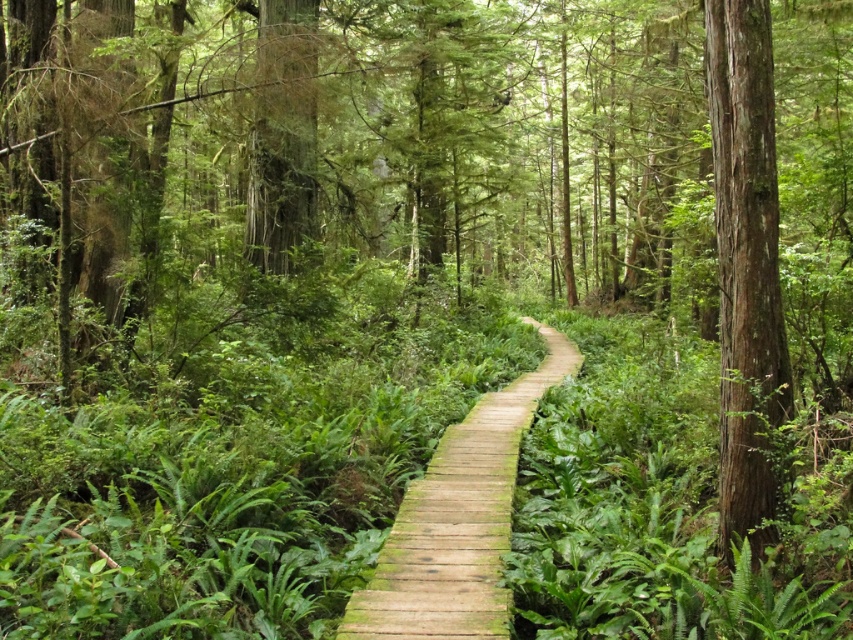
You are standing on the wooden planks at center and want to reach the smooth brown tree trunk at right. Which direction should you walk to get there?

You should walk to the right to reach the smooth brown tree trunk at right from the wooden planks at center, as it is located to the right of them.

You are standing at the start of the boardwalk and want to take a photo of the smooth brown tree trunk at right. If your camera can focus on objects up to 5 meters away, will it be able to capture the tree trunk clearly?

The smooth brown tree trunk at right is 5.38 meters away from the camera, which is beyond the camera focus range of 5 meters. Therefore, the camera may not capture the tree trunk clearly.

You are a park ranger assessing the boardwalk structure. You notice the smooth brown tree trunk at right and the wooden planks at center. Which object takes up more horizontal space in the scene?

The wooden planks at center take up more horizontal space than the smooth brown tree trunk at right because the smooth brown tree trunk at right occupies less space than wooden planks at center.